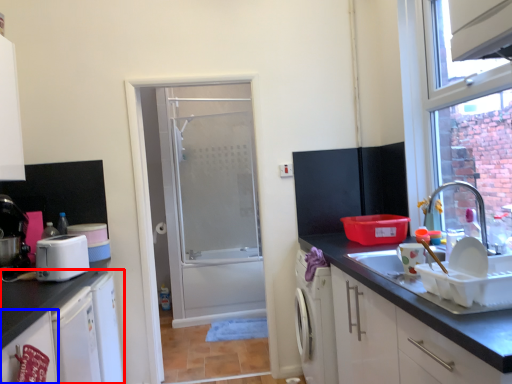
Question: Which object appears farthest to the camera in this image, cabinetry (highlighted by a red box) or cabinetry (highlighted by a blue box)?

Choices:
 (A) cabinetry
 (B) cabinetry

Answer: (A)